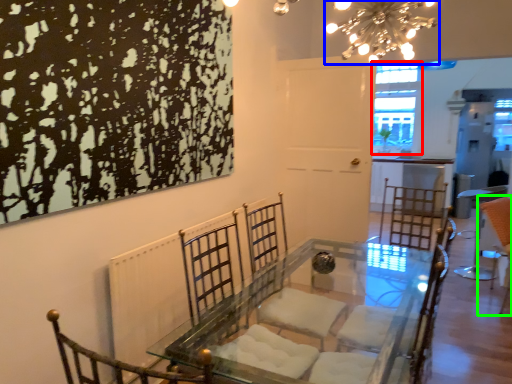
Question: Estimate the real-world distances between objects in this image. Which object is farther from window (highlighted by a red box), light fixture (highlighted by a blue box) or swivel chair (highlighted by a green box)?

Choices:
 (A) light fixture
 (B) swivel chair

Answer: (A)